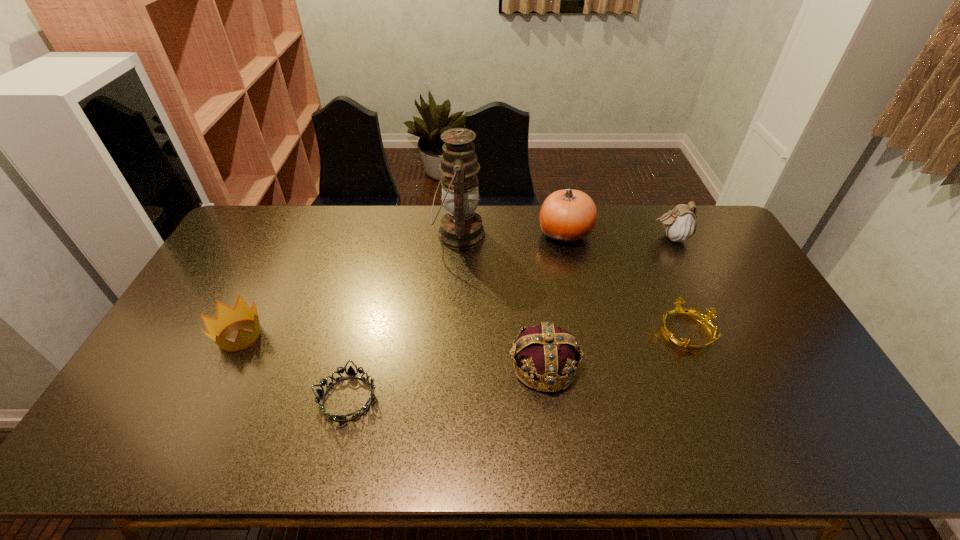
At what (x,y) coordinates should I click in order to perform the action: click on pouch that is at the far edge. Please return your answer as a coordinate pair (x, y). Image resolution: width=960 pixels, height=540 pixels. Looking at the image, I should click on (680, 224).

Locate an element on the screen. The image size is (960, 540). object positioned at the near edge is located at coordinates (350, 373).

Identify the location of object at the left edge. This screenshot has height=540, width=960. (225, 315).

The image size is (960, 540). I want to click on object situated at the right edge, so click(x=680, y=224).

Where is `object at the far right corner`? object at the far right corner is located at coordinates (680, 224).

Identify the location of vacant area at the far edge. The image size is (960, 540). (598, 208).

This screenshot has height=540, width=960. I want to click on free space at the near edge of the desktop, so click(452, 461).

This screenshot has height=540, width=960. I want to click on free space at the left edge, so click(172, 400).

The width and height of the screenshot is (960, 540). In order to click on free location at the right edge in this screenshot , I will do `click(740, 293)`.

The width and height of the screenshot is (960, 540). In the image, there is a desktop. Identify the location of free region at the far left corner. (273, 233).